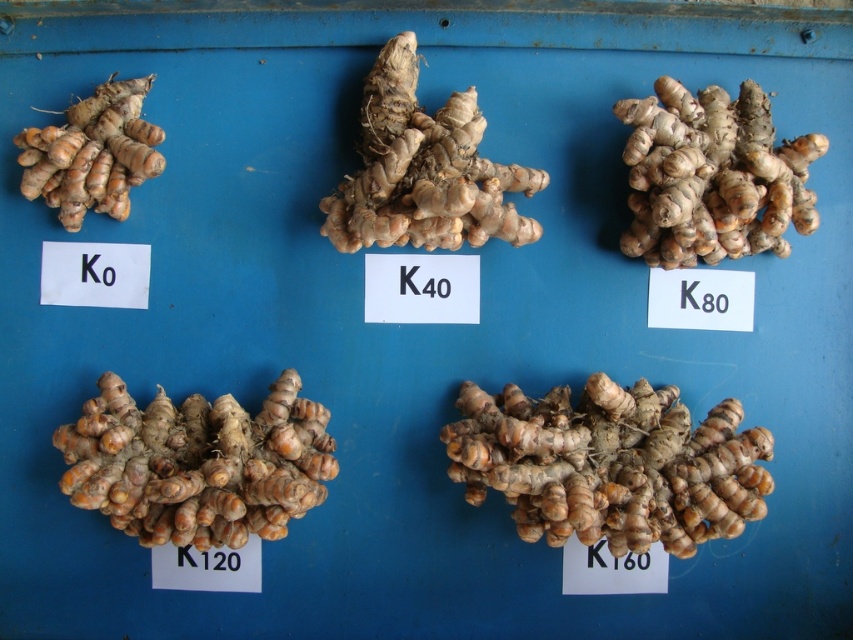
Question: Can you confirm if yellowish-brown textured ginger at center is positioned above orange-brown textured root at bottom left?

Choices:
 (A) yes
 (B) no

Answer: (B)

Question: Is orange-brown textured root at bottom left smaller than brown rough ginger at center?

Choices:
 (A) no
 (B) yes

Answer: (B)

Question: Does orange-brown textured root at bottom left have a smaller size compared to orange-brown textured ginger at upper left?

Choices:
 (A) yes
 (B) no

Answer: (B)

Question: Which point is farther from the camera taking this photo?

Choices:
 (A) (473, 426)
 (B) (136, 161)
 (C) (120, 486)
 (D) (680, 161)

Answer: (A)

Question: Which object is positioned farthest from the yellowish-brown textured ginger at center?

Choices:
 (A) orange-brown textured ginger at upper left
 (B) orange-brown textured root at bottom left

Answer: (A)

Question: Estimate the real-world distances between objects in this image. Which object is farther from the orange-brown textured ginger at upper left?

Choices:
 (A) orange-brown textured root at bottom left
 (B) brown rough ginger at right
 (C) yellowish-brown textured ginger at center
 (D) brown rough ginger at center

Answer: (B)